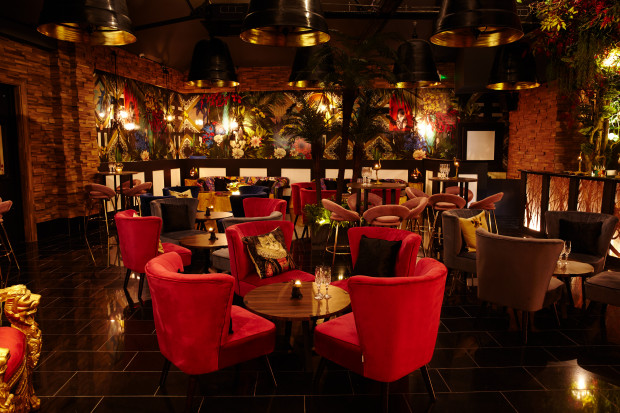
Where is `floor tile`? The image size is (620, 413). floor tile is located at coordinates (118, 387).